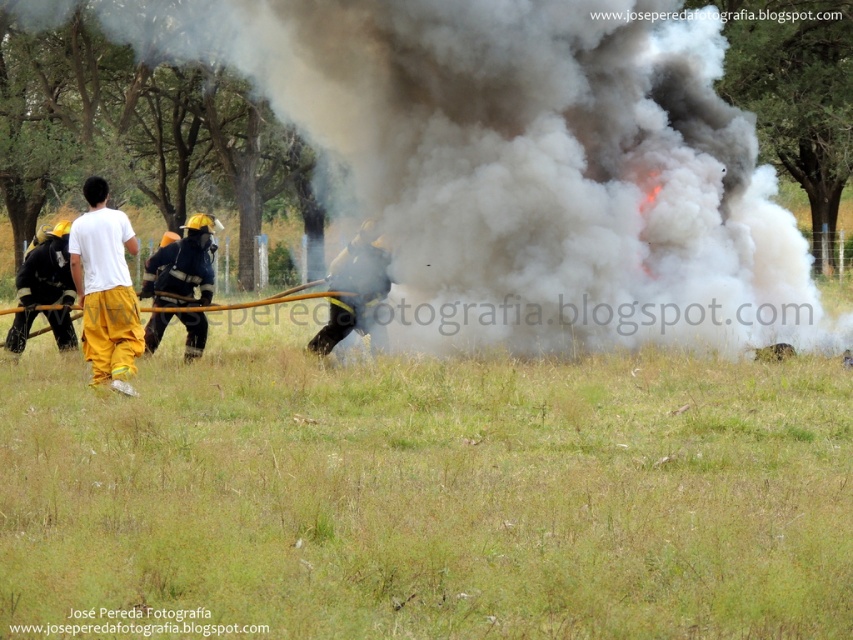
You are a firefighter in the scene and you need to grab your yellow fire helmet at center. Where should you look relative to the white cotton shirt at left?

The yellow fire helmet at center is above the white cotton shirt at left, so you should look upwards from the white cotton shirt at left to find the yellow fire helmet at center.

You are a firefighter trying to navigate through the scene. Considering the black smoke at center and the yellow fire helmet at center, which object is wider from your perspective?

The black smoke at center is wider than the yellow fire helmet at center, so the black smoke at center appears wider.